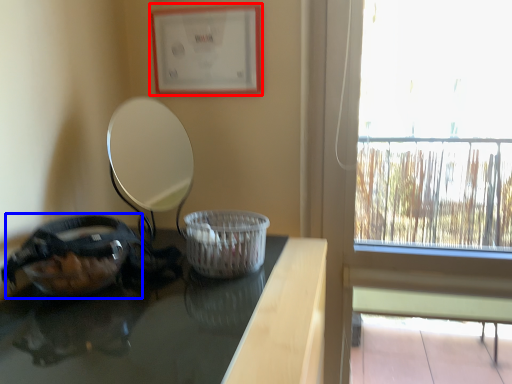
Question: Which of the following is the closest to the observer, picture frame (highlighted by a red box) or glass bowl (highlighted by a blue box)?

Choices:
 (A) picture frame
 (B) glass bowl

Answer: (B)